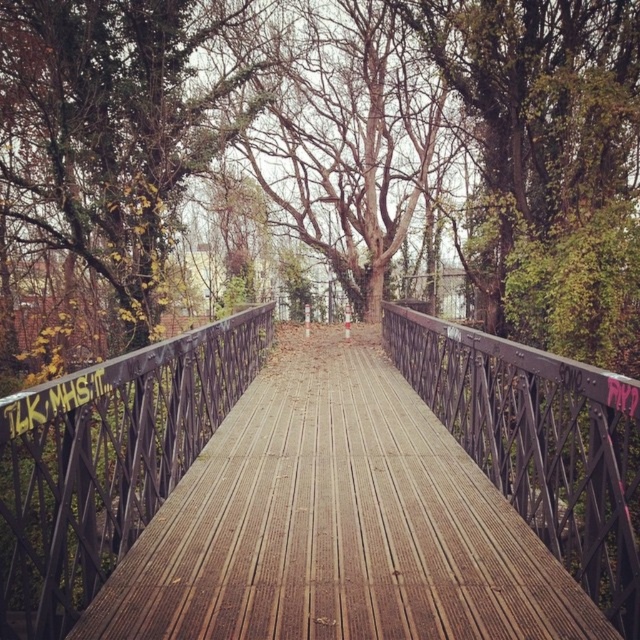
You are standing on the wooden bridge and want to know which metal structure is closer to you. Can you determine which one is closer between the metallic black railing at center and the dark gray metal rail at center?

The metallic black railing at center is closer to you because it is in front of the dark gray metal rail at center.

You are standing on the wooden bridge and looking around. There is a point at coordinates (x=106, y=461). What object is located at that point?

The point at coordinates (x=106, y=461) corresponds to the metallic black railing at center.

You are standing on the wooden bridge and looking towards the center. Which object is closer to you between the wooden planks at center and the bare wood tree at center?

The wooden planks at center are closer to you since they are positioned in front of the bare wood tree at center.